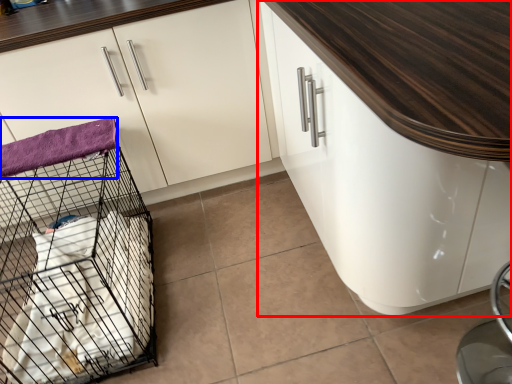
Question: Which object appears farthest to the camera in this image, cabinetry (highlighted by a red box) or blanket (highlighted by a blue box)?

Choices:
 (A) cabinetry
 (B) blanket

Answer: (B)